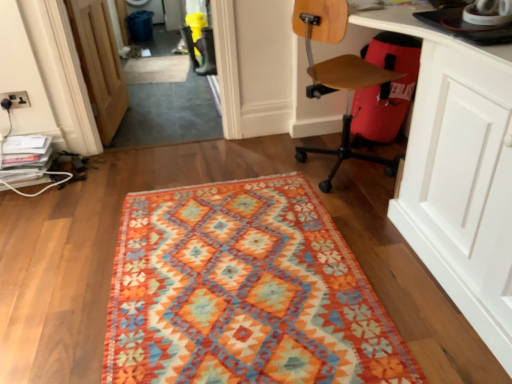
Where is `free spot behind wooden door at left`? This screenshot has height=384, width=512. free spot behind wooden door at left is located at coordinates (156, 98).